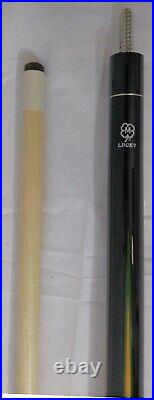
The width and height of the screenshot is (154, 400). I want to click on white surface, so click(x=78, y=96).